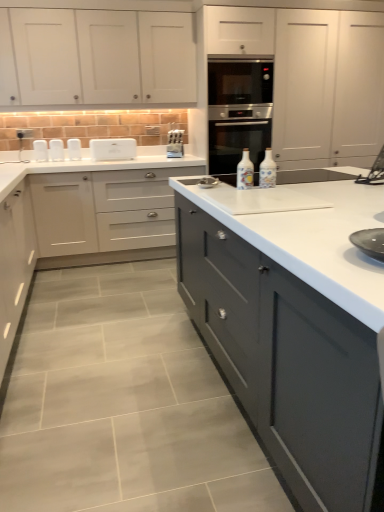
Where is `white ceramic bottle at center, positioned as the first bottle in left-to-right order`? white ceramic bottle at center, positioned as the first bottle in left-to-right order is located at coordinates (245, 172).

The height and width of the screenshot is (512, 384). In order to click on satin silver knife block at center, which is the fourth appliance in left-to-right order in this screenshot , I will do `click(175, 144)`.

Locate an element on the screen. The width and height of the screenshot is (384, 512). white plastic toaster at left, marked as the 2th appliance in a left-to-right arrangement is located at coordinates coord(74,149).

The width and height of the screenshot is (384, 512). What do you see at coordinates (74, 149) in the screenshot?
I see `white plastic toaster at left, marked as the 2th appliance in a left-to-right arrangement` at bounding box center [74, 149].

Locate an element on the screen. white plastic toaster at upper left, which is counted as the 4th appliance, starting from the right is located at coordinates (56, 150).

Where is `black glass oven at center`? black glass oven at center is located at coordinates (238, 135).

The image size is (384, 512). Describe the element at coordinates (113, 149) in the screenshot. I see `white plastic toaster at upper center, the 3th appliance in the left-to-right sequence` at that location.

Locate an element on the screen. white matte cabinet at upper left, the fourth cabinetry ordered from the bottom is located at coordinates (96, 57).

From the image's perspective, between white plastic toaster at upper left, marked as the first appliance in a left-to-right arrangement, and white matte cabinet at center, which ranks as the 2th cabinetry in top-to-bottom order, who is located below?

white plastic toaster at upper left, marked as the first appliance in a left-to-right arrangement, is shown below in the image.

Is white plastic toaster at upper left, marked as the first appliance in a left-to-right arrangement, inside the boundaries of white matte cabinet at center, which ranks as the 2th cabinetry in top-to-bottom order, or outside?

white plastic toaster at upper left, marked as the first appliance in a left-to-right arrangement, lies outside white matte cabinet at center, which ranks as the 2th cabinetry in top-to-bottom order.

Considering the sizes of objects white plastic toaster at upper left, marked as the first appliance in a left-to-right arrangement, and white matte cabinet at center, marked as the third cabinetry in a bottom-to-top arrangement, in the image provided, who is smaller, white plastic toaster at upper left, marked as the first appliance in a left-to-right arrangement, or white matte cabinet at center, marked as the third cabinetry in a bottom-to-top arrangement,?

Smaller between the two is white plastic toaster at upper left, marked as the first appliance in a left-to-right arrangement.

Is white plastic toaster at upper left, which is counted as the 4th appliance, starting from the right, to the right of white matte cabinet at center, marked as the third cabinetry in a bottom-to-top arrangement, from the viewer's perspective?

No.

Which of these two, white matte cabinet at center, which ranks as the 2th cabinetry in top-to-bottom order, or black glass oven at center, is bigger?

white matte cabinet at center, which ranks as the 2th cabinetry in top-to-bottom order.

Considering the positions of objects white matte cabinet at center, marked as the third cabinetry in a bottom-to-top arrangement, and black glass oven at center in the image provided, who is more to the right, white matte cabinet at center, marked as the third cabinetry in a bottom-to-top arrangement, or black glass oven at center?

white matte cabinet at center, marked as the third cabinetry in a bottom-to-top arrangement.

From the image's perspective, is white matte cabinet at center, marked as the third cabinetry in a bottom-to-top arrangement, located beneath black glass oven at center?

Actually, white matte cabinet at center, marked as the third cabinetry in a bottom-to-top arrangement, appears above black glass oven at center in the image.

From a real-world perspective, is white matte cabinet at center, which ranks as the 2th cabinetry in top-to-bottom order, below black glass oven at center?

Incorrect, from a real-world perspective, white matte cabinet at center, which ranks as the 2th cabinetry in top-to-bottom order, is higher than black glass oven at center.

From the image's perspective, count 1st cabinetrys upward from the white plastic toaster at left, marked as the 2th appliance in a left-to-right arrangement, and point to it. Please provide its 2D coordinates.

[(313, 78)]

Based on the photo, between white plastic toaster at left, marked as the 2th appliance in a left-to-right arrangement, and white matte cabinet at center, marked as the third cabinetry in a bottom-to-top arrangement, which one has larger width?

Wider between the two is white matte cabinet at center, marked as the third cabinetry in a bottom-to-top arrangement.

From the image's perspective, which one is positioned lower, white plastic toaster at left, marked as the 2th appliance in a left-to-right arrangement, or white matte cabinet at center, marked as the third cabinetry in a bottom-to-top arrangement?

From the image's view, white plastic toaster at left, marked as the 2th appliance in a left-to-right arrangement, is below.

Could white plastic toaster at upper center, marked as the second appliance in a right-to-left arrangement, be considered to be inside matte white cabinets at center, the 1th cabinetry in the bottom-to-top sequence?

No, white plastic toaster at upper center, marked as the second appliance in a right-to-left arrangement, is not inside matte white cabinets at center, the 1th cabinetry in the bottom-to-top sequence.

Is matte white cabinets at center, the 4th cabinetry in the top-to-bottom sequence, far from white plastic toaster at upper center, the 3th appliance in the left-to-right sequence?

matte white cabinets at center, the 4th cabinetry in the top-to-bottom sequence, is far away from white plastic toaster at upper center, the 3th appliance in the left-to-right sequence.

Considering the relative sizes of matte white cabinets at center, the 4th cabinetry in the top-to-bottom sequence, and white plastic toaster at upper center, the 3th appliance in the left-to-right sequence, in the image provided, is matte white cabinets at center, the 4th cabinetry in the top-to-bottom sequence, smaller than white plastic toaster at upper center, the 3th appliance in the left-to-right sequence,?

No, matte white cabinets at center, the 4th cabinetry in the top-to-bottom sequence, is not smaller than white plastic toaster at upper center, the 3th appliance in the left-to-right sequence.

Looking at this image, from the image's perspective, which is below, matte white cabinets at center, the 4th cabinetry in the top-to-bottom sequence, or white plastic toaster at upper center, the 3th appliance in the left-to-right sequence?

matte white cabinets at center, the 4th cabinetry in the top-to-bottom sequence, is shown below in the image.

From a real-world perspective, is white matte cabinet at center, which is the second cabinetry from bottom to top, physically located above or below white plastic toaster at left, acting as the 3th appliance starting from the right?

In terms of real-world spatial position, white matte cabinet at center, which is the second cabinetry from bottom to top, is below white plastic toaster at left, acting as the 3th appliance starting from the right.

Consider the image. Can you tell me how much white matte cabinet at center, which is the second cabinetry from bottom to top, and white plastic toaster at left, marked as the 2th appliance in a left-to-right arrangement, differ in facing direction?

The facing directions of white matte cabinet at center, which is the second cabinetry from bottom to top, and white plastic toaster at left, marked as the 2th appliance in a left-to-right arrangement, are 0.495 degrees apart.

Does white matte cabinet at center, which is the second cabinetry from bottom to top, appear on the left side of white plastic toaster at left, marked as the 2th appliance in a left-to-right arrangement?

No, white matte cabinet at center, which is the second cabinetry from bottom to top, is not to the left of white plastic toaster at left, marked as the 2th appliance in a left-to-right arrangement.

Is white matte cabinet at center, which is the second cabinetry from bottom to top, taller or shorter than white plastic toaster at left, acting as the 3th appliance starting from the right?

Clearly, white matte cabinet at center, which is the second cabinetry from bottom to top, is taller compared to white plastic toaster at left, acting as the 3th appliance starting from the right.

Is white plastic toaster at upper center, the 3th appliance in the left-to-right sequence, placed right next to satin silver knife block at center, the first appliance from the right?

They are not placed beside each other.

Measure the distance between white plastic toaster at upper center, marked as the second appliance in a right-to-left arrangement, and satin silver knife block at center, the first appliance from the right.

white plastic toaster at upper center, marked as the second appliance in a right-to-left arrangement, and satin silver knife block at center, the first appliance from the right, are 18.37 inches apart.

How many degrees apart are the facing directions of white plastic toaster at upper center, the 3th appliance in the left-to-right sequence, and satin silver knife block at center, the first appliance from the right?

The facing directions of white plastic toaster at upper center, the 3th appliance in the left-to-right sequence, and satin silver knife block at center, the first appliance from the right, are 0.000169 degrees apart.

In the image, is white plastic toaster at upper center, the 3th appliance in the left-to-right sequence, on the left side or the right side of satin silver knife block at center, which is the fourth appliance in left-to-right order?

white plastic toaster at upper center, the 3th appliance in the left-to-right sequence, is to the left of satin silver knife block at center, which is the fourth appliance in left-to-right order.

From a real-world perspective, which is physically below, black glass oven at center or satin silver knife block at center, the first appliance from the right?

satin silver knife block at center, the first appliance from the right.

Between black glass oven at center and satin silver knife block at center, which is the fourth appliance in left-to-right order, which one has smaller size?

satin silver knife block at center, which is the fourth appliance in left-to-right order, is smaller.

Is black glass oven at center facing away from satin silver knife block at center, the first appliance from the right?

black glass oven at center does not have its back to satin silver knife block at center, the first appliance from the right.

Locate an element on the screen. This screenshot has width=384, height=512. the 2nd cabinetry in front of the white plastic toaster at upper left, marked as the first appliance in a left-to-right arrangement is located at coordinates (313, 78).

Find the location of a particular element. The height and width of the screenshot is (512, 384). the 1st cabinetry positioned above the black glass oven at center (from the image's perspective) is located at coordinates (313, 78).

Which object lies nearer to the anchor point matte white cabinets at center, the 4th cabinetry in the top-to-bottom sequence, white ceramic bottle at center, positioned as the first bottle in left-to-right order, or white plastic toaster at upper center, the 3th appliance in the left-to-right sequence?

Based on the image, white ceramic bottle at center, positioned as the first bottle in left-to-right order, appears to be nearer to matte white cabinets at center, the 4th cabinetry in the top-to-bottom sequence.

From the picture: Which object lies nearer to the anchor point white matte cabinet at center, which is the second cabinetry from bottom to top, white plastic toaster at upper left, marked as the first appliance in a left-to-right arrangement, or white plastic toaster at upper center, marked as the second appliance in a right-to-left arrangement?

The object closer to white matte cabinet at center, which is the second cabinetry from bottom to top, is white plastic toaster at upper center, marked as the second appliance in a right-to-left arrangement.

Which object lies nearer to the anchor point satin silver knife block at center, the first appliance from the right, white ceramic bottle at center, positioned as the first bottle in left-to-right order, or matte white cabinets at center, the 4th cabinetry in the top-to-bottom sequence?

white ceramic bottle at center, positioned as the first bottle in left-to-right order, is positioned closer to the anchor satin silver knife block at center, the first appliance from the right.

Considering their positions, is white matte cabinet at upper left, the fourth cabinetry ordered from the bottom, positioned closer to white ceramic bottle at center, arranged as the 1th bottle when viewed from the right, than white matte cabinet at center, acting as the 3th cabinetry starting from the top?

white matte cabinet at center, acting as the 3th cabinetry starting from the top, is positioned closer to the anchor white ceramic bottle at center, arranged as the 1th bottle when viewed from the right.

In the scene shown: Which object lies nearer to the anchor point white matte cabinet at center, which is the second cabinetry from bottom to top, black glass oven at center or matte white cabinets at center, the 4th cabinetry in the top-to-bottom sequence?

black glass oven at center is positioned closer to the anchor white matte cabinet at center, which is the second cabinetry from bottom to top.

Considering their positions, is white matte cabinet at upper left, the fourth cabinetry ordered from the bottom, positioned further to black glass oven at center than white plastic toaster at upper center, marked as the second appliance in a right-to-left arrangement?

Among the two, white plastic toaster at upper center, marked as the second appliance in a right-to-left arrangement, is located further to black glass oven at center.

Estimate the real-world distances between objects in this image. Which object is further from white plastic toaster at upper left, which is counted as the 4th appliance, starting from the right, black glass oven at center or white matte cabinet at center, which is the second cabinetry from bottom to top?

Among the two, black glass oven at center is located further to white plastic toaster at upper left, which is counted as the 4th appliance, starting from the right.

From the image, which object appears to be nearer to white matte cabinet at center, which is the second cabinetry from bottom to top, white plastic toaster at left, acting as the 3th appliance starting from the right, or black glass oven at center?

The object closer to white matte cabinet at center, which is the second cabinetry from bottom to top, is white plastic toaster at left, acting as the 3th appliance starting from the right.

Locate an element on the screen. home appliance between white ceramic bottle at center, positioned as the second bottle in left-to-right order, and white plastic toaster at upper center, marked as the second appliance in a right-to-left arrangement, from front to back is located at coordinates (238, 135).

Where is `appliance between white matte cabinet at center, acting as the 3th cabinetry starting from the top, and white matte cabinet at center, marked as the third cabinetry in a bottom-to-top arrangement, in the horizontal direction`? appliance between white matte cabinet at center, acting as the 3th cabinetry starting from the top, and white matte cabinet at center, marked as the third cabinetry in a bottom-to-top arrangement, in the horizontal direction is located at coordinates (175, 144).

Identify the location of appliance located between white matte cabinet at center, which is the second cabinetry from bottom to top, and black glass oven at center in the left-right direction. The height and width of the screenshot is (512, 384). (175, 144).

Locate an element on the screen. The height and width of the screenshot is (512, 384). home appliance between white ceramic bottle at center, which appears as the second bottle when viewed from the right, and white plastic toaster at upper left, which is counted as the 4th appliance, starting from the right, from front to back is located at coordinates (238, 135).